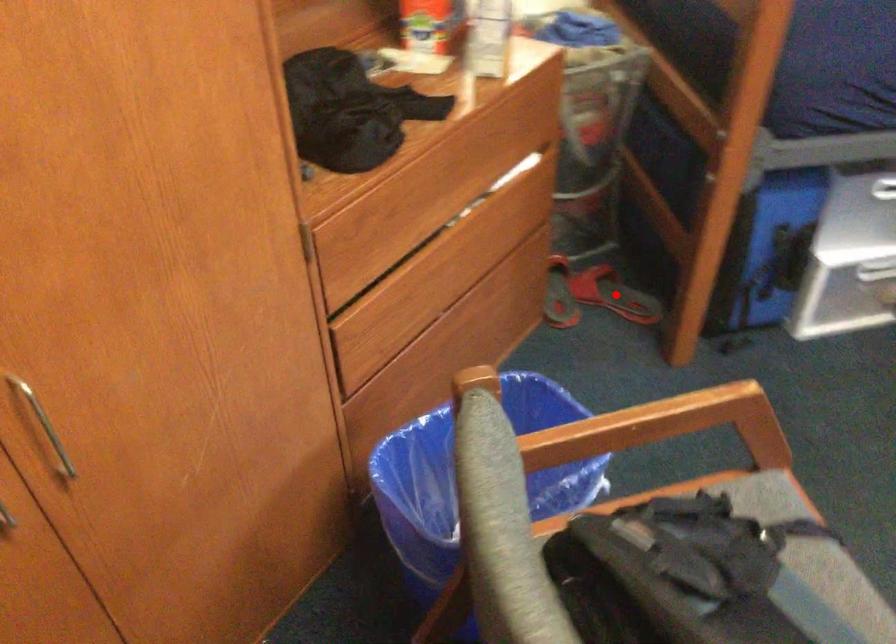
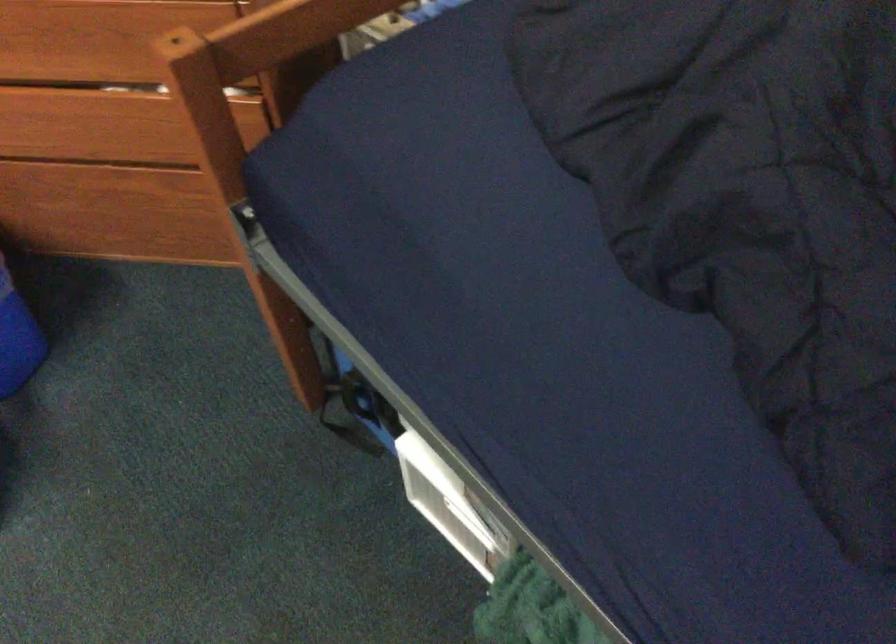
Question: I am providing you with two images of the same scene from different viewpoints. A red point is marked on the first image. Can you still see the location of the red point in image 2?

Choices:
 (A) Yes
 (B) No

Answer: (B)